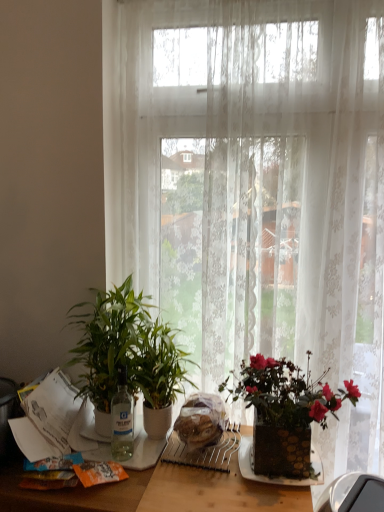
Identify the location of vacant space positioned to the left of matte brown plate at center. (206, 487).